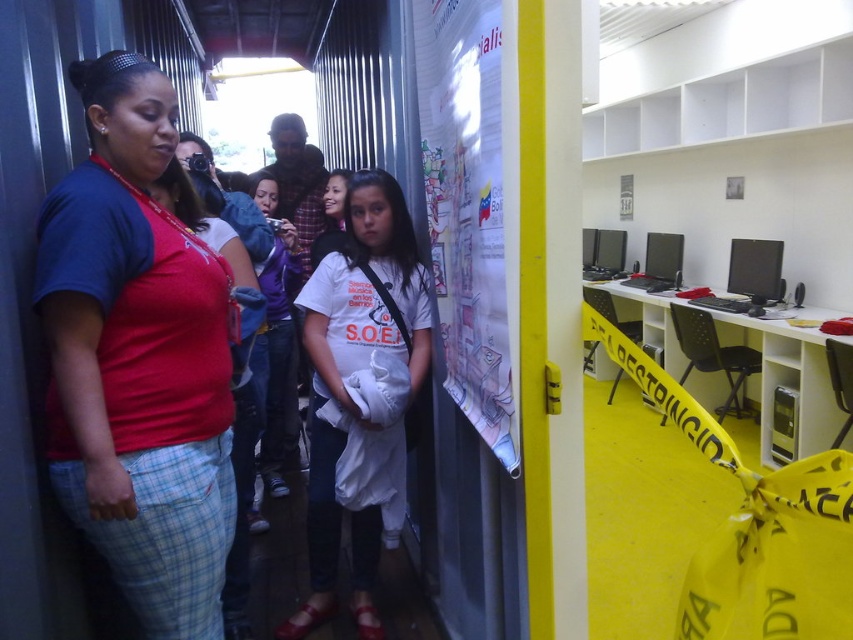
Question: Which of the following is the farthest from the observer?

Choices:
 (A) white paper poster at center
 (B) black glossy monitor at center

Answer: (B)

Question: Can you confirm if red cotton shirt at left is positioned above black glossy monitor at center?

Choices:
 (A) no
 (B) yes

Answer: (A)

Question: Which point appears farthest from the camera in this image?

Choices:
 (A) (77, 356)
 (B) (433, 88)
 (C) (641, 285)
 (D) (299, 273)

Answer: (C)

Question: Can you confirm if purple fleece jacket at center is positioned to the left of black glossy monitor at center?

Choices:
 (A) no
 (B) yes

Answer: (B)

Question: Considering the real-world distances, which object is closest to the purple fleece jacket at center?

Choices:
 (A) red cotton shirt at left
 (B) black glossy monitor at center
 (C) white cotton shirt at center
 (D) white paper poster at center

Answer: (C)

Question: Does purple fleece jacket at center have a lesser width compared to black glossy monitor at center?

Choices:
 (A) no
 (B) yes

Answer: (A)